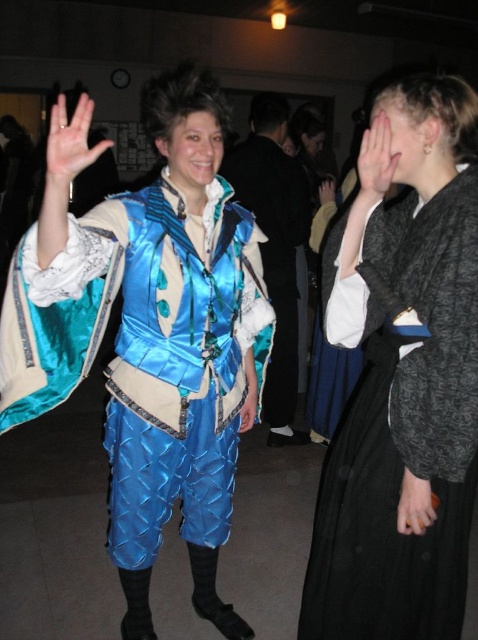
Between shiny blue armor at center and black matte dress at right, which one is positioned lower?

black matte dress at right is below.

You are a GUI agent. You are given a task and a screenshot of the screen. Output one action in this format:
    pyautogui.click(x=<x>, y=<y>)
    Task: Click on the shiny blue armor at center
    The image size is (478, 640).
    Given the screenshot: What is the action you would take?
    pyautogui.click(x=151, y=339)

Can you confirm if shiny blue armor at center is positioned below blue satin hand at center?

No.

Can you confirm if shiny blue armor at center is taller than blue satin hand at center?

Yes.

What do you see at coordinates (151, 339) in the screenshot? This screenshot has width=478, height=640. I see `shiny blue armor at center` at bounding box center [151, 339].

Find the location of a particular element. This screenshot has width=478, height=640. shiny blue armor at center is located at coordinates (151, 339).

Is point (369, 195) closer to viewer compared to point (251, 422)?

Yes.

Can you confirm if smooth skin hand at upper right is positioned to the left of blue satin hand at center?

Incorrect, smooth skin hand at upper right is not on the left side of blue satin hand at center.

I want to click on smooth skin hand at upper right, so click(376, 160).